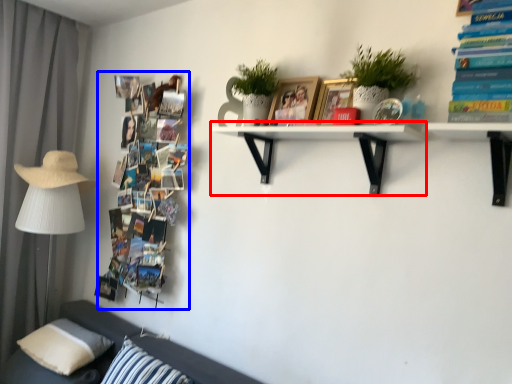
Question: Which object is further to the camera taking this photo, shelf (highlighted by a red box) or book (highlighted by a blue box)?

Choices:
 (A) shelf
 (B) book

Answer: (B)